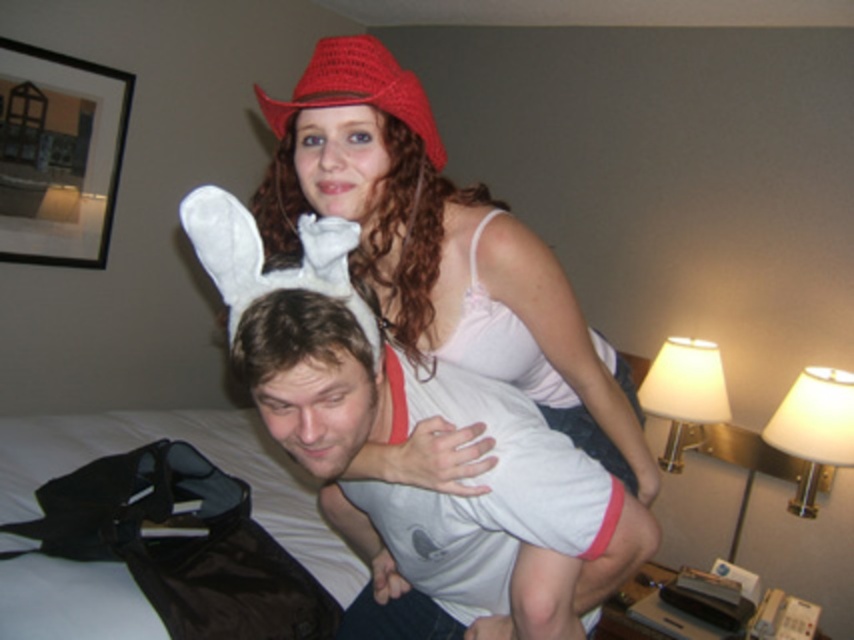
Question: Does white cotton shirt at upper center have a larger size compared to crochet red hat at upper center?

Choices:
 (A) no
 (B) yes

Answer: (B)

Question: Which object is farther from the camera taking this photo?

Choices:
 (A) white plush hat at upper center
 (B) crochet red hat at upper center
 (C) white cotton shirt at upper center

Answer: (B)

Question: Based on their relative distances, which object is nearer to the white plush hat at upper center?

Choices:
 (A) crochet red hat at upper center
 (B) white cotton shirt at upper center

Answer: (A)

Question: Can you confirm if white cotton shirt at upper center is positioned to the left of crochet red hat at upper center?

Choices:
 (A) yes
 (B) no

Answer: (B)

Question: Which point appears closest to the camera in this image?

Choices:
 (A) (361, 104)
 (B) (230, 196)

Answer: (B)

Question: Does white cotton shirt at upper center come behind white plush hat at upper center?

Choices:
 (A) yes
 (B) no

Answer: (B)